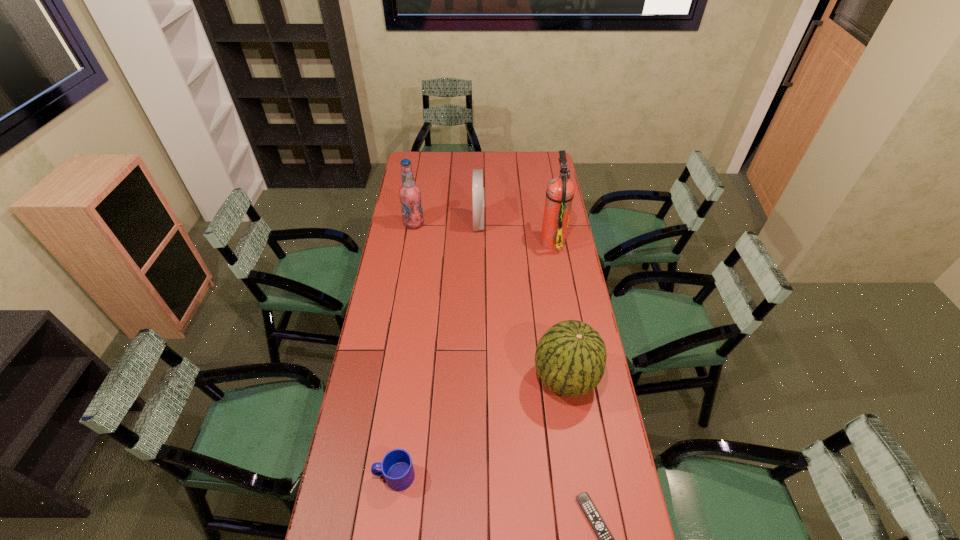
At what (x,y) coordinates should I click in order to perform the action: click on object that stands as the fifth closest to the first-aid kit. Please return your answer as a coordinate pair (x, y). The image size is (960, 540). Looking at the image, I should click on (606, 539).

In order to click on free location that satisfies the following two spatial constraints: 1. on the front-facing side of the third object from left to right; 2. on the front side of the alcohol in this screenshot , I will do `click(479, 224)`.